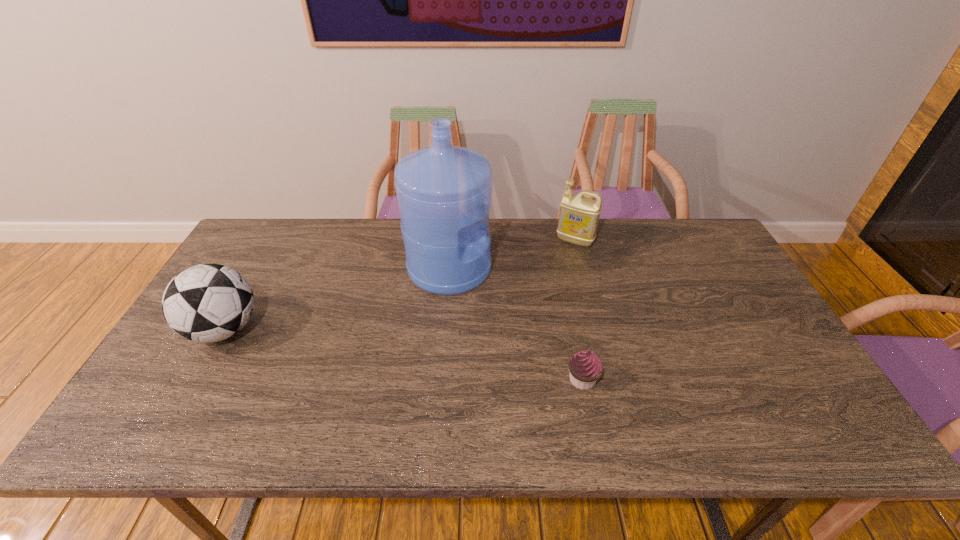
Find the location of a particular element. object that ranks as the second closest to the second nearest object is located at coordinates (585, 367).

Locate which object is the closest to the nearest object. Please provide its 2D coordinates. Your answer should be formatted as a tuple, i.e. [(x, y)], where the tuple contains the x and y coordinates of a point satisfying the conditions above.

[(444, 192)]

At what (x,y) coordinates should I click in order to perform the action: click on blank area in the image that satisfies the following two spatial constraints: 1. on the surface of the third farthest object where the brand logo is visible; 2. on the right side of the cupcake. Please return your answer as a coordinate pair (x, y). This screenshot has height=540, width=960. Looking at the image, I should click on (196, 380).

The width and height of the screenshot is (960, 540). In order to click on vacant space that satisfies the following two spatial constraints: 1. on the side of the water jug with the handle; 2. on the right side of the cupcake in this screenshot , I will do `click(441, 380)`.

Identify the location of free point that satisfies the following two spatial constraints: 1. on the back side of the shortest object; 2. on the surface of the third farthest object where the brand logo is visible. (572, 329).

Locate an element on the screen. The image size is (960, 540). vacant area that satisfies the following two spatial constraints: 1. on the back side of the nearest object; 2. on the side of the second object from left to right with the handle is located at coordinates (560, 268).

This screenshot has height=540, width=960. I want to click on blank area in the image that satisfies the following two spatial constraints: 1. on the side of the tallest object with the handle; 2. on the right side of the cupcake, so click(x=441, y=380).

Locate an element on the screen. The height and width of the screenshot is (540, 960). vacant space that satisfies the following two spatial constraints: 1. on the back side of the detergent; 2. on the right side of the shortest object is located at coordinates (554, 241).

You are a GUI agent. You are given a task and a screenshot of the screen. Output one action in this format:
    pyautogui.click(x=<x>, y=<y>)
    Task: Click on the vacant region that satisfies the following two spatial constraints: 1. on the side of the water jug with the handle; 2. on the left side of the shortest object
    The height and width of the screenshot is (540, 960).
    Given the screenshot: What is the action you would take?
    pyautogui.click(x=441, y=380)